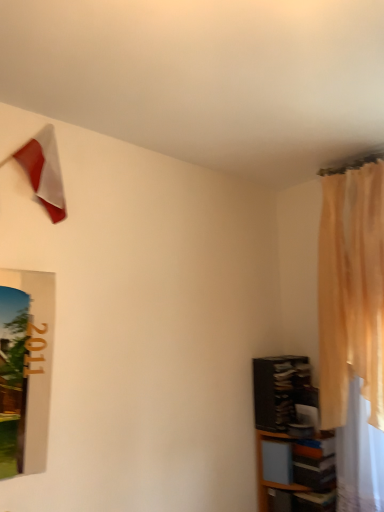
Question: Considering the positions of point (284, 369) and point (299, 503), is point (284, 369) closer or farther from the camera than point (299, 503)?

Choices:
 (A) farther
 (B) closer

Answer: (A)

Question: From a real-world perspective, is black glossy shelf at lower right, which is counted as the second shelf, starting from the bottom, physically located above or below wooden shelf at lower right, marked as the second shelf in a top-to-bottom arrangement?

Choices:
 (A) above
 (B) below

Answer: (A)

Question: Which of these objects is positioned closest to the wooden shelf at lower right, the 1th shelf from the bottom?

Choices:
 (A) black glossy shelf at lower right, placed as the 1th shelf when sorted from top to bottom
 (B) matte red flag at upper left
 (C) light beige sheer curtain at right

Answer: (A)

Question: Which object is positioned farthest from the black glossy shelf at lower right, placed as the 1th shelf when sorted from top to bottom?

Choices:
 (A) light beige sheer curtain at right
 (B) matte red flag at upper left
 (C) wooden shelf at lower right, marked as the second shelf in a top-to-bottom arrangement

Answer: (B)